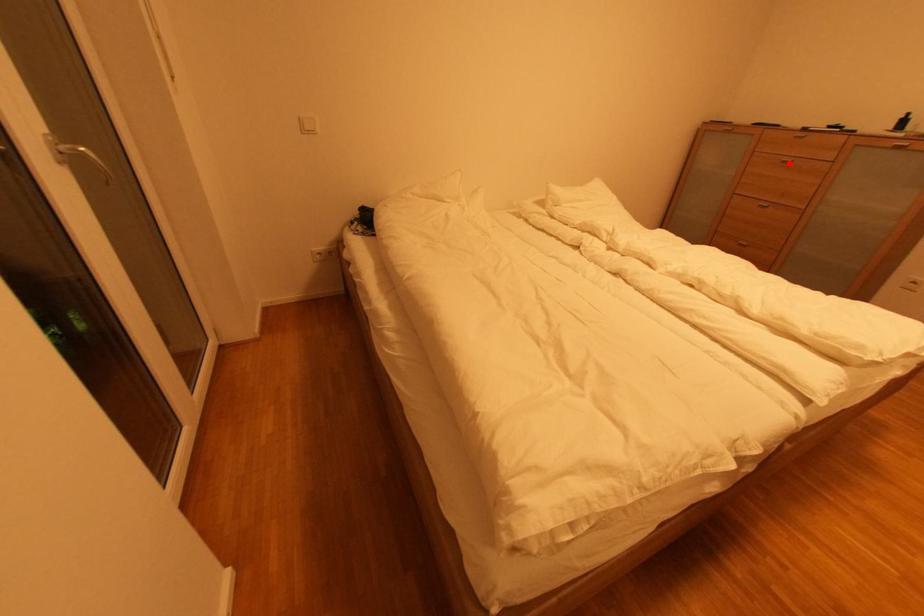
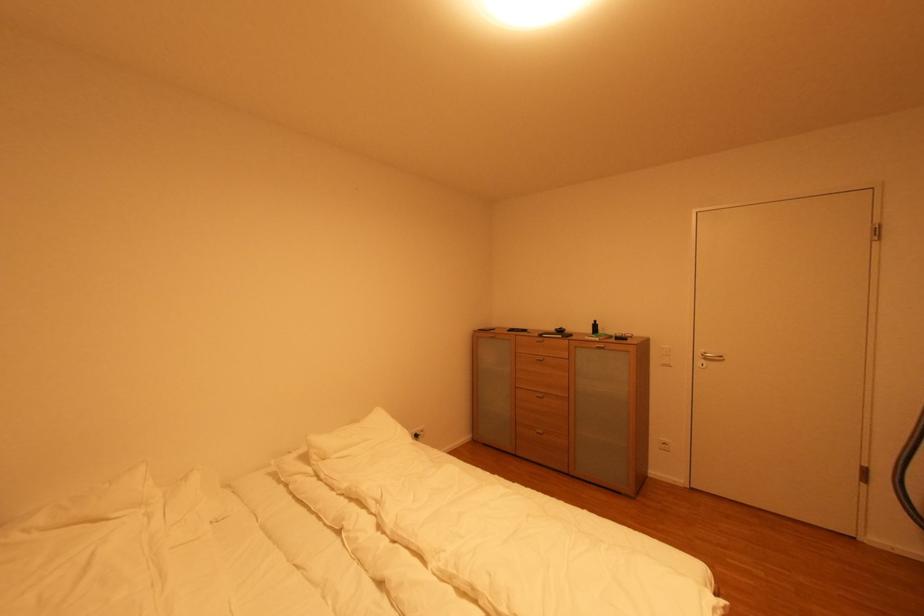
Question: I am providing you with two images of the same scene from different viewpoints. A red point is marked on the first image. Is the red point's position out of view in image 2?

Choices:
 (A) Yes
 (B) No

Answer: (B)